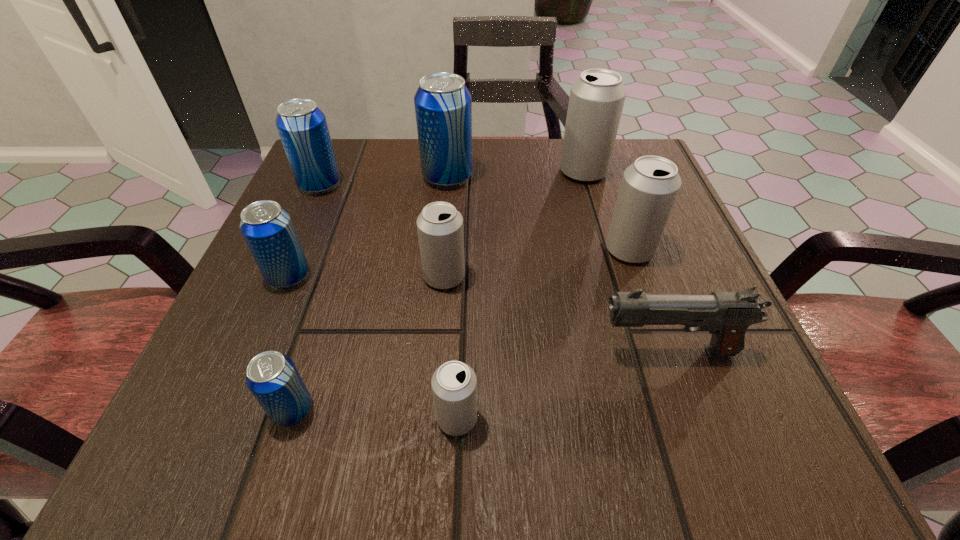
You are a GUI agent. You are given a task and a screenshot of the screen. Output one action in this format:
    pyautogui.click(x=<x>, y=<y>)
    Task: Click on the nearest white beer can
    The height and width of the screenshot is (540, 960).
    Given the screenshot: What is the action you would take?
    click(x=454, y=384)

The height and width of the screenshot is (540, 960). I want to click on free spot located 0.360m on the right of the rightmost blue beer can, so click(646, 177).

Locate an element on the screen. The width and height of the screenshot is (960, 540). vacant region located on the front of the farthest white beer can is located at coordinates (605, 245).

Find the location of a particular element. The height and width of the screenshot is (540, 960). vacant space located on the front of the second biggest blue beer can is located at coordinates (287, 261).

Image resolution: width=960 pixels, height=540 pixels. Identify the location of free space located on the left of the third smallest white beer can. (396, 249).

Identify the location of vacant point located on the right of the third biggest white beer can. Image resolution: width=960 pixels, height=540 pixels. (539, 277).

The image size is (960, 540). I want to click on vacant space located on the right of the second nearest blue beer can, so click(x=476, y=276).

This screenshot has width=960, height=540. I want to click on free spot located 0.350m in the direction the seventh farthest object is aimed, so click(x=345, y=352).

Find the location of a particular element. The image size is (960, 540). blank area located 0.180m in the direction the seventh farthest object is aimed is located at coordinates (467, 352).

The image size is (960, 540). I want to click on vacant region located 0.340m in the direction the seventh farthest object is aimed, so click(x=352, y=352).